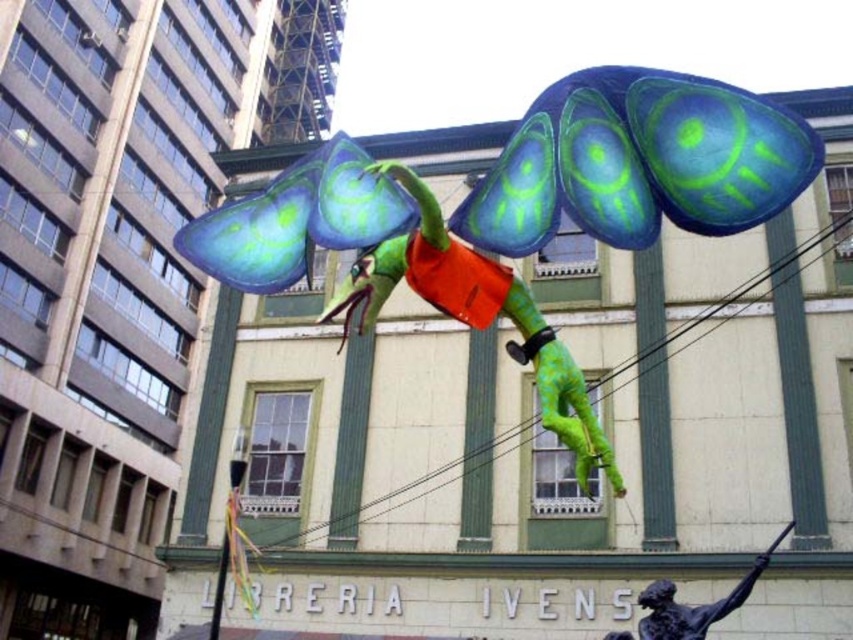
You are an art curator planning to display both the green matte sculpture at center and the bronze statue at lower right in an exhibition. Based on their sizes, which one should be placed in a more prominent location to highlight its features?

The green matte sculpture at center is larger than the bronze statue at lower right, so it should be placed in a more prominent location to highlight its features.

You are standing in a city park and see the green matte sculpture at center. If you want to take a photo of it from a distance where it appears small but still recognizable, would 55.28 feet be a suitable distance?

The green matte sculpture at center is 55.28 feet away from viewer, so yes, this distance would allow the sculpture to appear small but still recognizable in the photo.

You are an art curator planning to display the green matte sculpture at center and the bronze statue at lower right in a new exhibition. Based on their sizes, which object should be placed on a higher pedestal to ensure both are visible to visitors standing at the same viewing level?

The green matte sculpture at center is taller than the bronze statue at lower right, so it should be placed on a lower pedestal to ensure both are visible at the same viewing level.